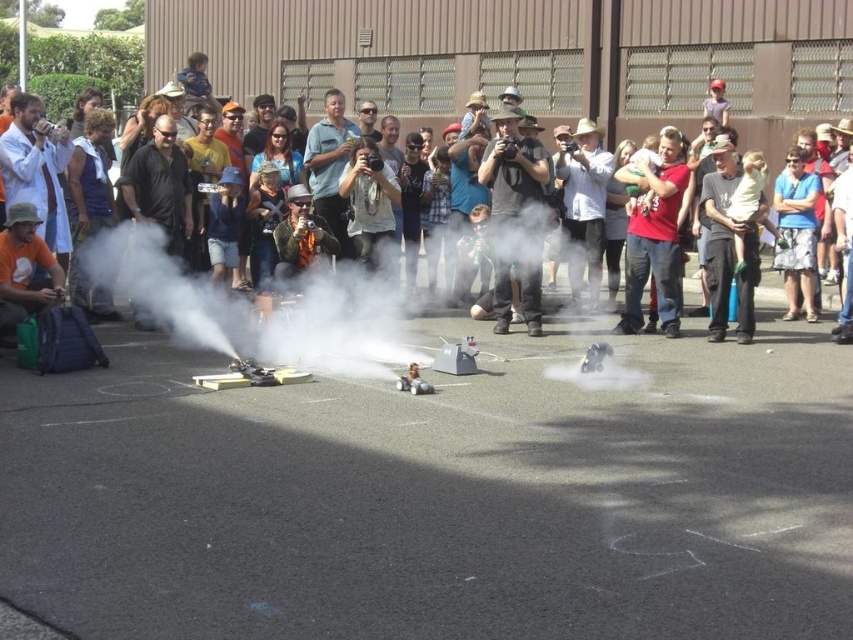
Question: Among these points, which one is nearest to the camera?

Choices:
 (A) (750, 221)
 (B) (244, 348)

Answer: (B)

Question: Which of the following is the closest to the observer?

Choices:
 (A) red cotton shirt at center
 (B) white smoke at center
 (C) blue floral shorts at center
 (D) matte black camera at center

Answer: (B)

Question: Can you confirm if white smoke at center is thinner than matte black camera at center?

Choices:
 (A) no
 (B) yes

Answer: (A)

Question: Which point is closer to the camera?

Choices:
 (A) matte gray shirt at center
 (B) white smoke at center
 (C) matte black laptop at center
 (D) matte black camera at center

Answer: (B)

Question: Is matte black camera at center thinner than blue floral shorts at center?

Choices:
 (A) yes
 (B) no

Answer: (B)

Question: Can you confirm if matte black camera at center is positioned to the right of red cotton shirt at center?

Choices:
 (A) yes
 (B) no

Answer: (B)